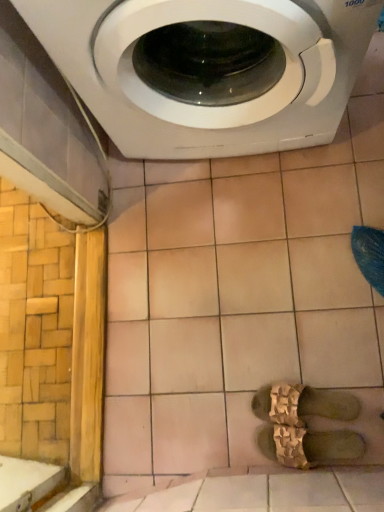
What are the coordinates of `vacant space in gold textured sandals at center, the first shoe when ordered from top to bottom (from a real-world perspective)` in the screenshot? It's located at (316, 404).